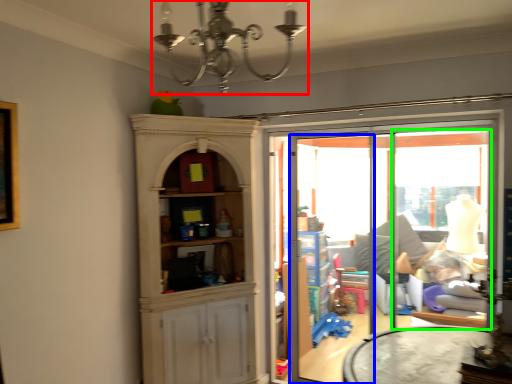
Question: Considering the real-world distances, which object is closest to light fixture (highlighted by a red box)? screen door (highlighted by a blue box) or window (highlighted by a green box).

Choices:
 (A) screen door
 (B) window

Answer: (A)